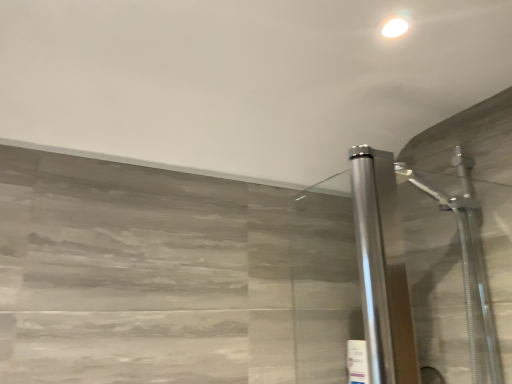
Image resolution: width=512 pixels, height=384 pixels. What do you see at coordinates (466, 264) in the screenshot?
I see `polished stainless steel shower door at upper right` at bounding box center [466, 264].

The width and height of the screenshot is (512, 384). In order to click on polished stainless steel shower door at upper right in this screenshot , I will do `click(466, 264)`.

At what (x,y) coordinates should I click in order to perform the action: click on polished stainless steel shower door at upper right. Please return your answer as a coordinate pair (x, y). The width and height of the screenshot is (512, 384). Looking at the image, I should click on (466, 264).